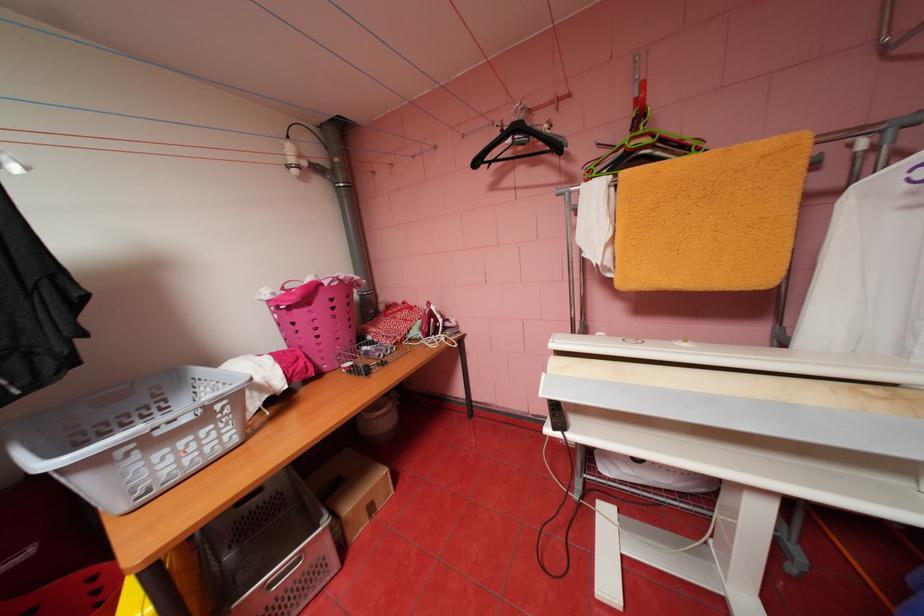
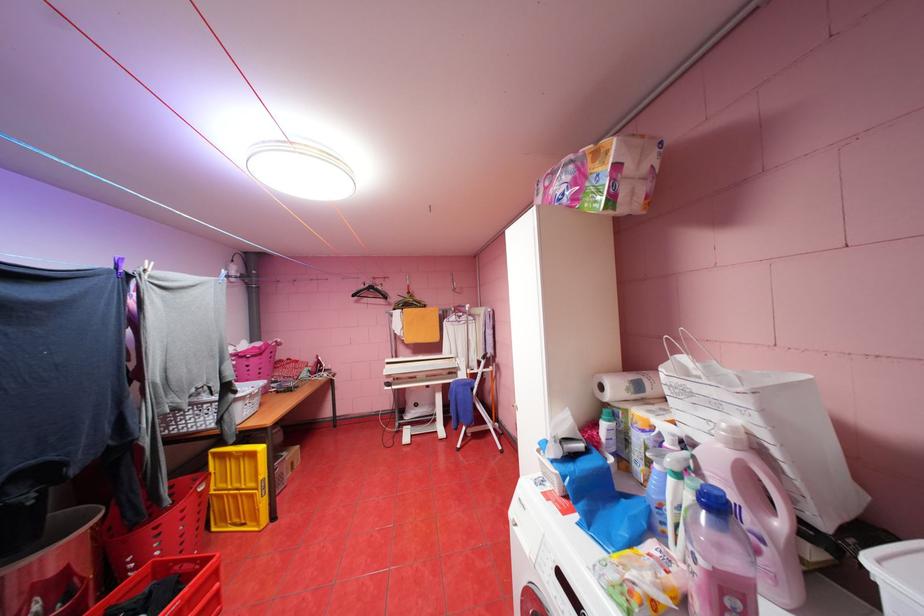
The point at (563, 429) is marked in the first image. Where is the corresponding point in the second image?

(396, 387)